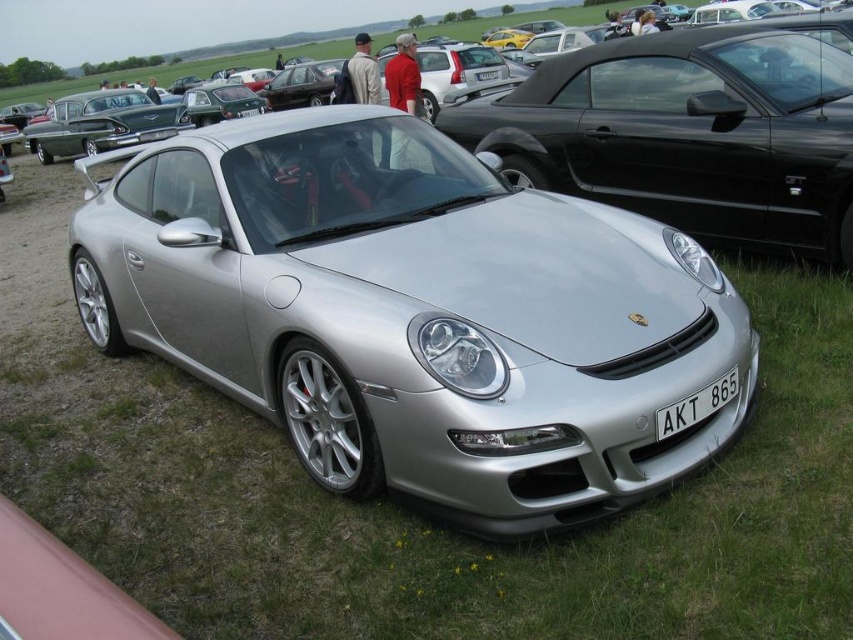
Question: Does silver metallic car at center appear under white plastic license plate at front?

Choices:
 (A) no
 (B) yes

Answer: (A)

Question: Which of the following is the closest to the observer?

Choices:
 (A) (724, 182)
 (B) (663, 413)

Answer: (B)

Question: Which of the following is the farthest from the observer?

Choices:
 (A) (730, 388)
 (B) (587, 122)

Answer: (B)

Question: Does silver metallic car at center appear over white plastic license plate at front?

Choices:
 (A) no
 (B) yes

Answer: (B)

Question: Does silver metallic car at center appear under white plastic license plate at front?

Choices:
 (A) yes
 (B) no

Answer: (B)

Question: Which of the following is the farthest from the observer?

Choices:
 (A) white plastic license plate at front
 (B) silver metallic car at center

Answer: (B)